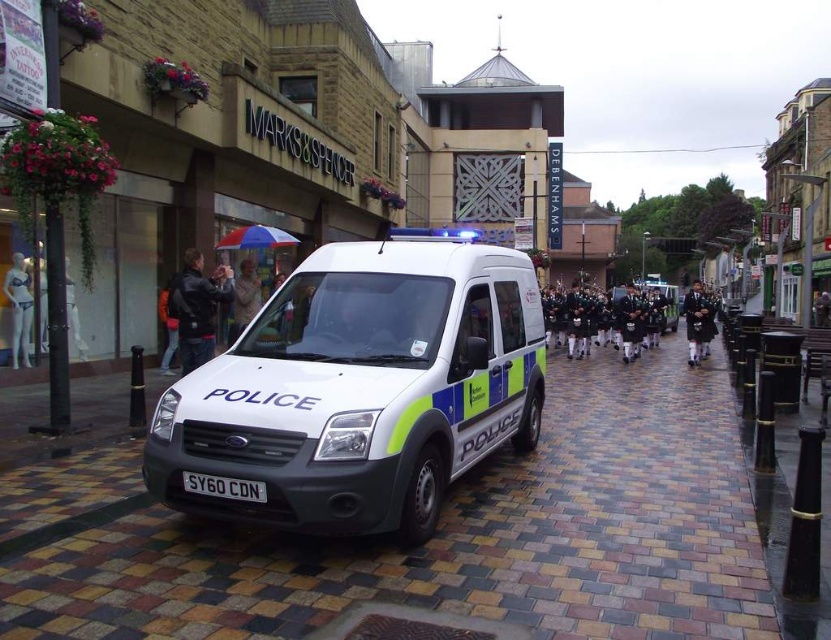
Question: Which of these objects is positioned closest to the brick paved sidewalk at center?

Choices:
 (A) white matte police van at center
 (B) white matte mannequin at left
 (C) black leather jacket at left
 (D) knitted sweater at center

Answer: (A)

Question: Which point is farther to the camera?

Choices:
 (A) pos(440,449)
 (B) pos(180,337)
 (C) pos(482,605)
 (D) pos(244,499)

Answer: (B)

Question: Which of the following is the farthest from the observer?

Choices:
 (A) (23, 328)
 (B) (180, 292)
 (C) (235, 289)
 (D) (370, 275)

Answer: (C)

Question: Can you confirm if brick paved sidewalk at center is bigger than black leather jacket at left?

Choices:
 (A) no
 (B) yes

Answer: (B)

Question: Can you confirm if brick paved sidewalk at center is thinner than knitted sweater at center?

Choices:
 (A) no
 (B) yes

Answer: (A)

Question: Is white matte mannequin at left positioned at the back of knitted sweater at center?

Choices:
 (A) no
 (B) yes

Answer: (A)